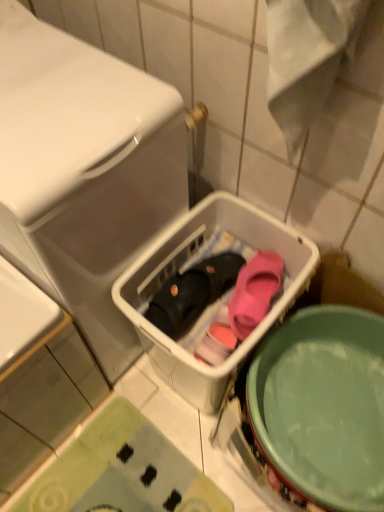
Question: From the image's perspective, would you say green matte mixing bowl at lower right is shown under green textured bath mat at lower left?

Choices:
 (A) no
 (B) yes

Answer: (A)

Question: From the image's perspective, is green matte mixing bowl at lower right above green textured bath mat at lower left?

Choices:
 (A) no
 (B) yes

Answer: (B)

Question: Is green matte mixing bowl at lower right in front of green textured bath mat at lower left?

Choices:
 (A) yes
 (B) no

Answer: (A)

Question: Is green matte mixing bowl at lower right beside green textured bath mat at lower left?

Choices:
 (A) yes
 (B) no

Answer: (B)

Question: Is there a large distance between green matte mixing bowl at lower right and green textured bath mat at lower left?

Choices:
 (A) no
 (B) yes

Answer: (A)

Question: From their relative heights in the image, would you say black matte slipper at center, which is the 1th footwear in left-to-right order, is taller or shorter than pink matte slipper at center, which ranks as the first footwear in right-to-left order?

Choices:
 (A) tall
 (B) short

Answer: (A)

Question: Based on their sizes in the image, would you say black matte slipper at center, which is the 1th footwear in left-to-right order, is bigger or smaller than pink matte slipper at center, the second footwear from the left?

Choices:
 (A) small
 (B) big

Answer: (B)

Question: From a real-world perspective, relative to pink matte slipper at center, which ranks as the first footwear in right-to-left order, is black matte slipper at center, the second footwear positioned from the right, vertically above or below?

Choices:
 (A) below
 (B) above

Answer: (A)

Question: Relative to pink matte slipper at center, the second footwear from the left, is black matte slipper at center, which is the 1th footwear in left-to-right order, in front or behind?

Choices:
 (A) behind
 (B) front

Answer: (A)

Question: Is green textured bath mat at lower left bigger or smaller than black matte slipper at center, the second footwear positioned from the right?

Choices:
 (A) big
 (B) small

Answer: (A)

Question: Does point (89, 488) appear closer or farther from the camera than point (178, 326)?

Choices:
 (A) farther
 (B) closer

Answer: (A)

Question: Visually, is green textured bath mat at lower left positioned to the left or to the right of black matte slipper at center, the second footwear positioned from the right?

Choices:
 (A) right
 (B) left

Answer: (B)

Question: From a real-world perspective, is green textured bath mat at lower left positioned above or below black matte slipper at center, the second footwear positioned from the right?

Choices:
 (A) above
 (B) below

Answer: (B)

Question: Is pink matte slipper at center, the second footwear from the left, bigger or smaller than white plastic basket at center, which ranks as the second dish washer in left-to-right order?

Choices:
 (A) big
 (B) small

Answer: (B)

Question: In the image, is pink matte slipper at center, the second footwear from the left, on the left side or the right side of white plastic basket at center, the 1th dish washer when ordered from right to left?

Choices:
 (A) right
 (B) left

Answer: (A)